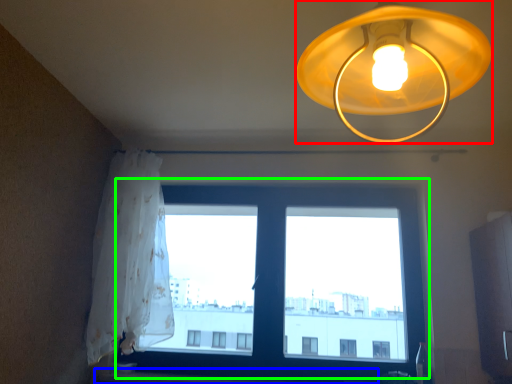
Question: Based on their relative distances, which object is nearer to lamp (highlighted by a red box)? Choose from window sill (highlighted by a blue box) and window (highlighted by a green box).

Choices:
 (A) window sill
 (B) window

Answer: (B)